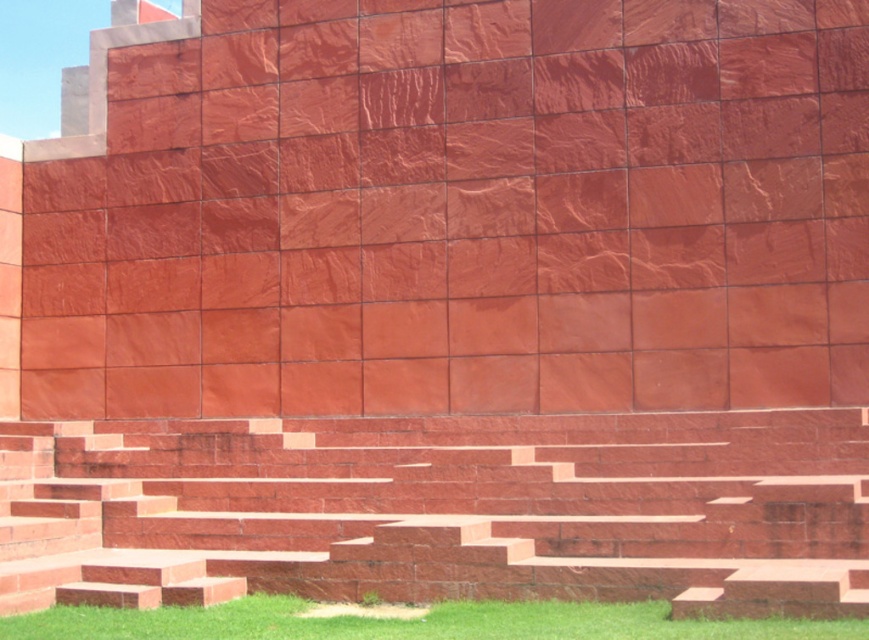
Is matte red stone wall at center bigger than polished red stone stairs at center?

Yes, matte red stone wall at center is bigger than polished red stone stairs at center.

Is matte red stone wall at center wider than polished red stone stairs at center?

Yes.

Is point (382, 368) farther from viewer compared to point (423, 497)?

That is True.

Identify the location of matte red stone wall at center. The height and width of the screenshot is (640, 869). click(454, 211).

Is polished red stone stairs at center positioned at the back of green grass at lower center?

No, it is not.

Can you confirm if polished red stone stairs at center is positioned to the right of green grass at lower center?

Incorrect, polished red stone stairs at center is not on the right side of green grass at lower center.

Is point (395, 564) positioned behind point (114, 620)?

That is True.

This screenshot has width=869, height=640. I want to click on polished red stone stairs at center, so click(x=445, y=509).

You are a GUI agent. You are given a task and a screenshot of the screen. Output one action in this format:
    pyautogui.click(x=<x>, y=<y>)
    Task: Click on the matte red stone wall at center
    
    Given the screenshot: What is the action you would take?
    pyautogui.click(x=454, y=211)

Does matte red stone wall at center appear on the right side of green grass at lower center?

No, matte red stone wall at center is not to the right of green grass at lower center.

Does point (54, 154) lie behind point (114, 618)?

Yes.

Identify the location of matte red stone wall at center. (454, 211).